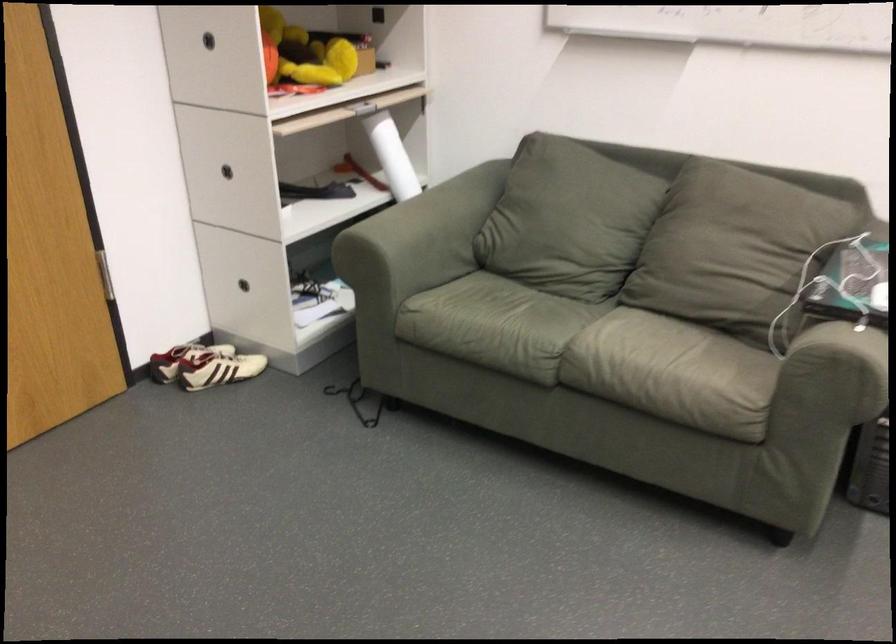
Find where to sit the green sofa sitting surface. Please return your answer as a coordinate pair (x, y).

(495, 325)